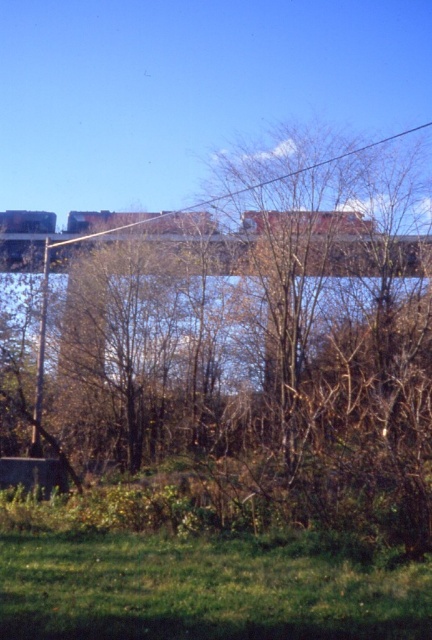
Question: Which object is farther from the camera taking this photo?

Choices:
 (A) metallic gray train bridge at center
 (B) brown leafy tree at center
 (C) metallic wire at upper center
 (D) green grass at lower center

Answer: (C)

Question: Which point appears farthest from the camera in this image?

Choices:
 (A) [216, 195]
 (B) [158, 244]

Answer: (A)

Question: From the image, what is the correct spatial relationship of brown leafy tree at center in relation to green grass at lower center?

Choices:
 (A) below
 (B) above

Answer: (B)

Question: Does brown leafy tree at center appear on the right side of metallic gray train bridge at center?

Choices:
 (A) no
 (B) yes

Answer: (B)

Question: Which of the following is the closest to the observer?

Choices:
 (A) (101, 308)
 (B) (266, 246)
 (C) (133, 225)
 (D) (79, 577)

Answer: (D)

Question: Does green grass at lower center come in front of metallic wire at upper center?

Choices:
 (A) yes
 (B) no

Answer: (A)